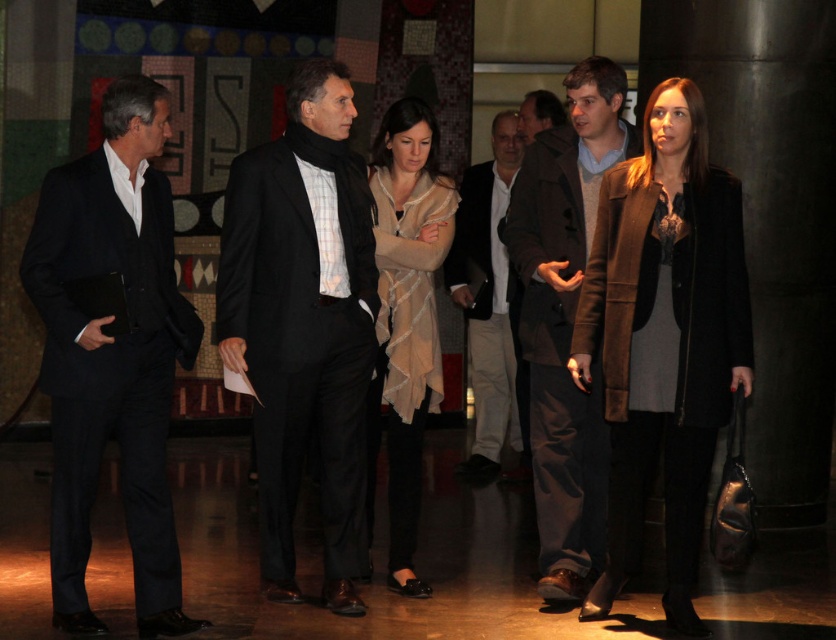
You are a photographer at the event. You want to take a photo that includes both the matte black suit at left and the beige textured dress at center. Which of the two should you focus on first to ensure both are in clear focus?

The matte black suit at left is closer to the viewer than the beige textured dress at center, so focusing on the matte black suit at left first will ensure both are in focus since it is the closer object.